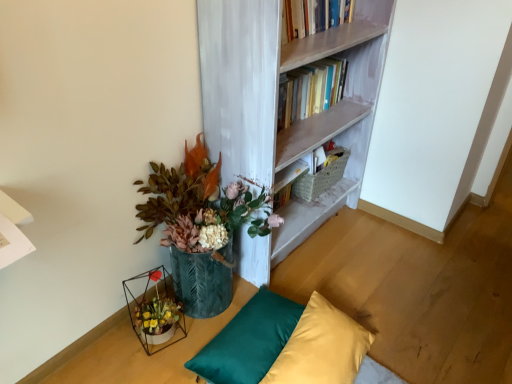
At what (x,y) coordinates should I click in order to perform the action: click on vacant area that is situated to the right of white painted wood bookcase at upper center. Please return your answer as a coordinate pair (x, y). Looking at the image, I should click on (395, 263).